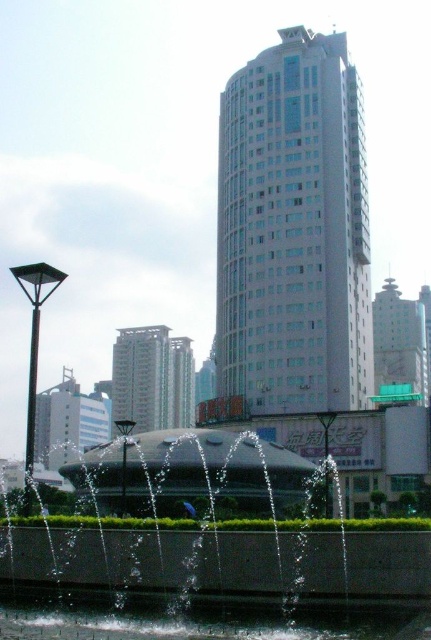
Question: Which of the following is the farthest from the observer?

Choices:
 (A) clear water at fountain center
 (B) concrete fountain at center

Answer: (A)

Question: Can you confirm if concrete fountain at center is positioned to the right of clear water at fountain center?

Choices:
 (A) no
 (B) yes

Answer: (A)

Question: Does concrete fountain at center have a larger size compared to clear water at fountain center?

Choices:
 (A) no
 (B) yes

Answer: (B)

Question: Which object is closer to the camera taking this photo?

Choices:
 (A) clear water at fountain center
 (B) concrete fountain at center

Answer: (B)

Question: Which point is closer to the camera?

Choices:
 (A) (21, 612)
 (B) (164, 456)

Answer: (A)

Question: Is concrete fountain at center to the left of clear water at fountain center from the viewer's perspective?

Choices:
 (A) yes
 (B) no

Answer: (A)